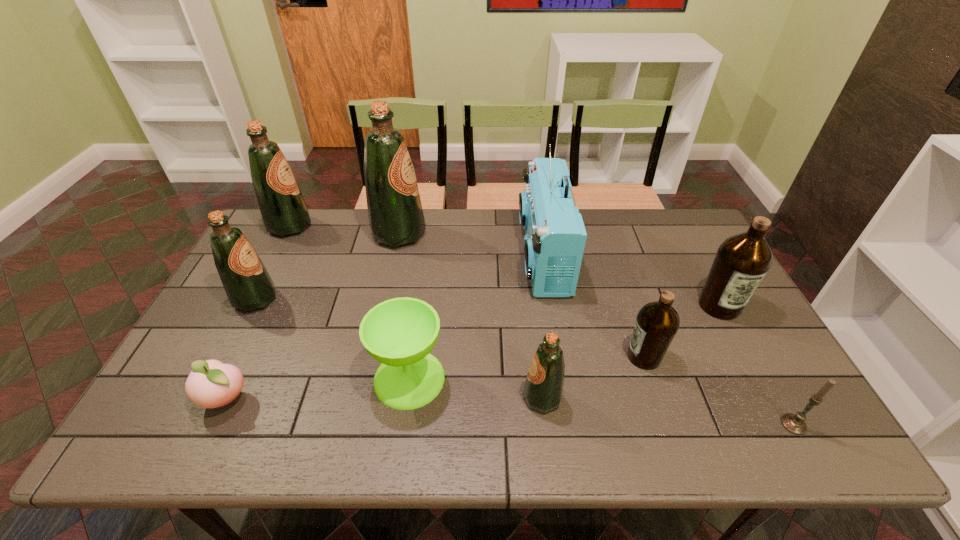
This screenshot has width=960, height=540. What are the coordinates of `vacant space situated 0.270m on the front-facing side of the second nearest green olive oil` in the screenshot? It's located at pyautogui.click(x=370, y=299).

Where is `free location located 0.150m on the label of the bigger brown olive oil`? This screenshot has width=960, height=540. free location located 0.150m on the label of the bigger brown olive oil is located at coordinates 753,368.

The height and width of the screenshot is (540, 960). Identify the location of free space located on the front-facing side of the smallest green olive oil. (396, 397).

Locate an element on the screen. The width and height of the screenshot is (960, 540). vacant space situated 0.380m on the front-facing side of the smallest green olive oil is located at coordinates (362, 397).

In order to click on vacant region located 0.210m on the front-facing side of the smallest green olive oil in this screenshot , I will do click(434, 397).

Find the location of a particular element. This screenshot has height=540, width=960. vacant region located on the label of the left brown olive oil is located at coordinates (481, 357).

Locate an element on the screen. The height and width of the screenshot is (540, 960). free space located 0.140m on the label of the left brown olive oil is located at coordinates (571, 357).

You are a GUI agent. You are given a task and a screenshot of the screen. Output one action in this format:
    pyautogui.click(x=<x>, y=<y>)
    Task: Click on the blank space located on the label of the left brown olive oil
    This screenshot has height=540, width=960.
    Given the screenshot: What is the action you would take?
    pyautogui.click(x=587, y=357)

Where is `vacant region located 0.060m on the back of the green wineglass`? This screenshot has height=540, width=960. vacant region located 0.060m on the back of the green wineglass is located at coordinates (416, 332).

At what (x,y) coordinates should I click in order to perform the action: click on free point located on the back of the candle. Please return your answer as a coordinate pair (x, y). The width and height of the screenshot is (960, 540). Looking at the image, I should click on (761, 367).